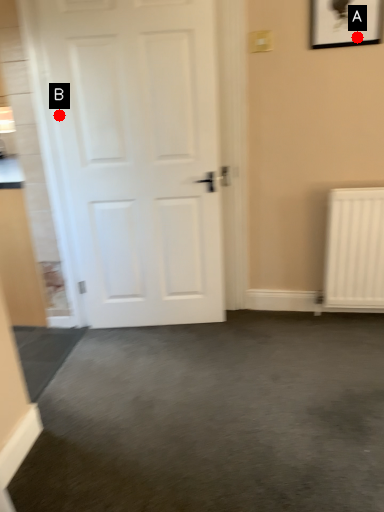
Question: Two points are circled on the image, labeled by A and B beside each circle. Which of the following is the closest to the observer?

Choices:
 (A) A is closer
 (B) B is closer

Answer: (A)